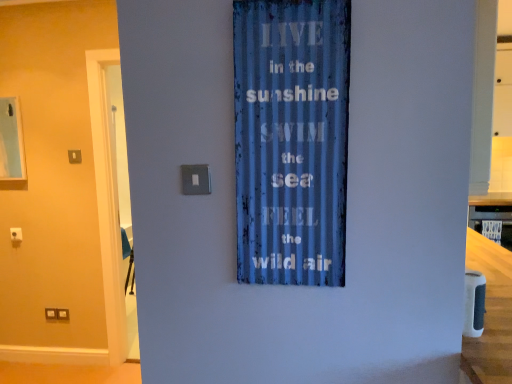
Question: Is smooth wooden counter top at right not near blue corrugated metal sign at center?

Choices:
 (A) no
 (B) yes

Answer: (B)

Question: From the image's perspective, does smooth wooden counter top at right appear higher than blue corrugated metal sign at center?

Choices:
 (A) no
 (B) yes

Answer: (A)

Question: Considering the relative positions of smooth wooden counter top at right and blue corrugated metal sign at center in the image provided, is smooth wooden counter top at right to the right of blue corrugated metal sign at center from the viewer's perspective?

Choices:
 (A) no
 (B) yes

Answer: (B)

Question: Is the surface of smooth wooden counter top at right in direct contact with blue corrugated metal sign at center?

Choices:
 (A) no
 (B) yes

Answer: (A)

Question: Is smooth wooden counter top at right smaller than blue corrugated metal sign at center?

Choices:
 (A) no
 (B) yes

Answer: (B)

Question: From the image's perspective, is smooth wooden counter top at right under blue corrugated metal sign at center?

Choices:
 (A) no
 (B) yes

Answer: (B)

Question: Does blue corrugated metal sign at center have a lesser width compared to satin silver switch at center, which is the first light switch from right to left?

Choices:
 (A) yes
 (B) no

Answer: (B)

Question: Is blue corrugated metal sign at center not close to satin silver switch at center, the 1th light switch viewed from the front?

Choices:
 (A) no
 (B) yes

Answer: (A)

Question: Does blue corrugated metal sign at center have a greater width compared to satin silver switch at center, positioned as the 2th light switch in left-to-right order?

Choices:
 (A) no
 (B) yes

Answer: (B)

Question: Can you confirm if blue corrugated metal sign at center is bigger than satin silver switch at center, which is the first light switch from right to left?

Choices:
 (A) no
 (B) yes

Answer: (B)

Question: Does blue corrugated metal sign at center appear on the left side of satin silver switch at center, which is the 2th light switch in back-to-front order?

Choices:
 (A) no
 (B) yes

Answer: (A)

Question: Is blue corrugated metal sign at center completely or partially outside of satin silver switch at center, the 1th light switch viewed from the front?

Choices:
 (A) no
 (B) yes

Answer: (B)

Question: From the image's perspective, is satin silver switch at center, positioned as the 2th light switch in left-to-right order, on smooth wooden counter top at right?

Choices:
 (A) yes
 (B) no

Answer: (A)